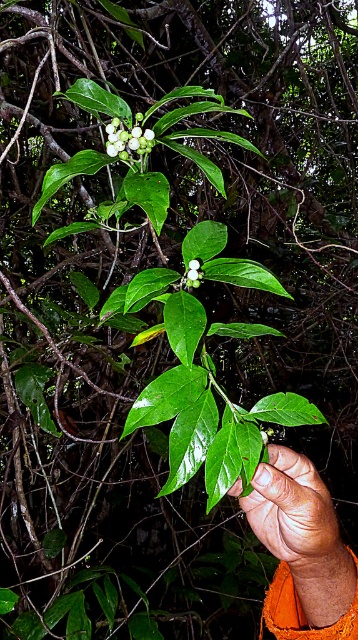
In the scene shown: Who is lower down, white matte berries at upper center or white matte flower at center?

white matte flower at center

Which is above, white matte berries at upper center or white matte flower at center?

white matte berries at upper center

Looking at this image, who is more distant from viewer, (139, 122) or (190, 273)?

The point (190, 273) is more distant.

You are a GUI agent. You are given a task and a screenshot of the screen. Output one action in this format:
    pyautogui.click(x=<x>, y=<y>)
    Task: Click on the white matte berries at upper center
    The width and height of the screenshot is (358, 640).
    Given the screenshot: What is the action you would take?
    pyautogui.click(x=128, y=138)

Is the position of brown skin at center more distant than that of white matte berries at upper center?

That is True.

Between brown skin at center and white matte berries at upper center, which one is positioned higher?

Positioned higher is white matte berries at upper center.

Which is behind, point (325, 520) or point (118, 147)?

Point (325, 520)

Locate an element on the screen. Image resolution: width=358 pixels, height=640 pixels. brown skin at center is located at coordinates (293, 513).

Consider the image. Can you confirm if brown skin at center is positioned to the right of white matte flower at center?

Correct, you'll find brown skin at center to the right of white matte flower at center.

Which is more to the right, brown skin at center or white matte flower at center?

Positioned to the right is brown skin at center.

Measure the distance between point (316, 545) and camera.

Point (316, 545) is 29.81 inches from camera.

The width and height of the screenshot is (358, 640). I want to click on brown skin at center, so click(293, 513).